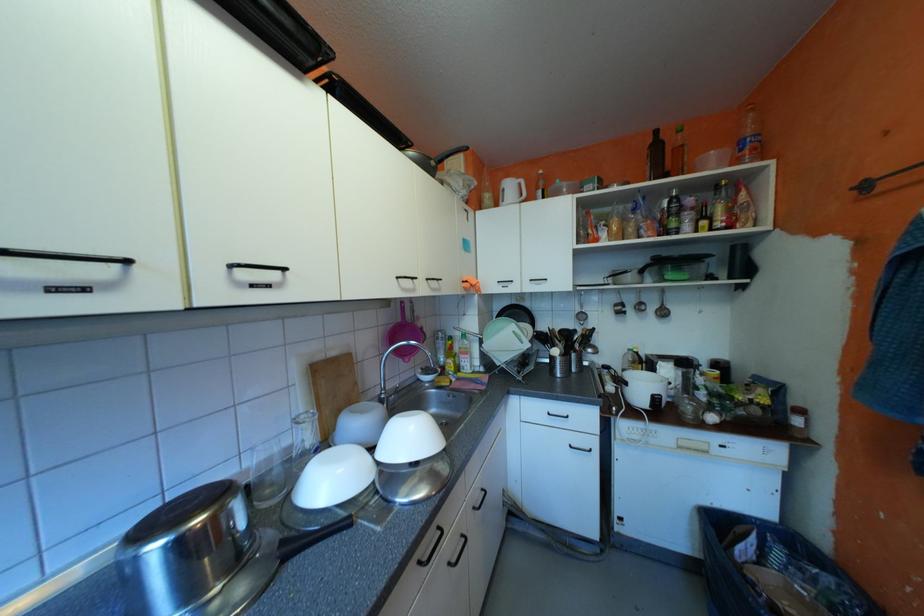
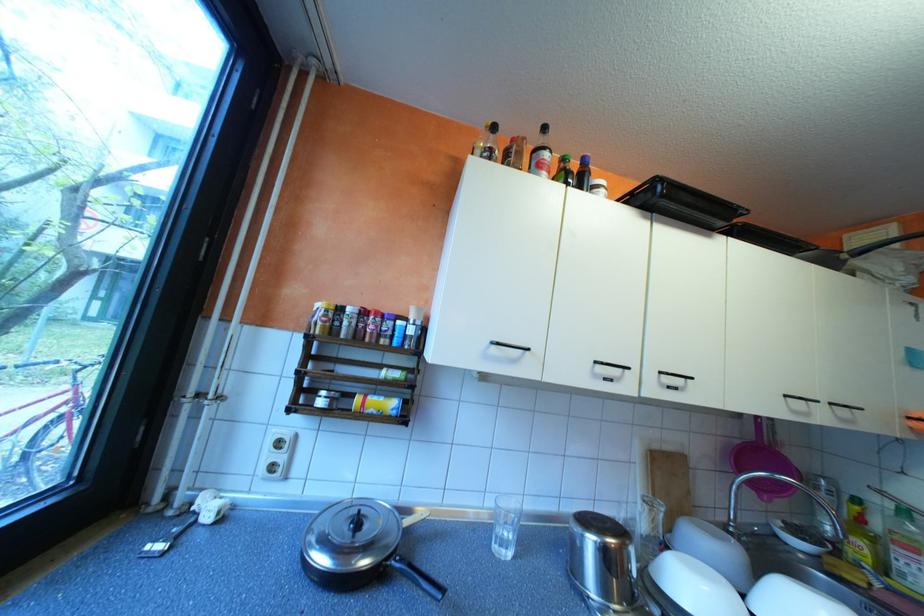
In the second image, find the point that corresponds to (x=462, y=360) in the first image.

(871, 541)